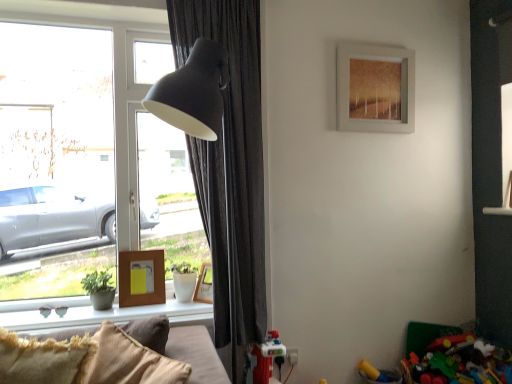
Question: Considering the relative sizes of woodenobject at lower left, which is the first picture frame from left to right, and matte brown picture frame at upper center, which is counted as the 1th picture frame, starting from the top, in the image provided, is woodenobject at lower left, which is the first picture frame from left to right, wider than matte brown picture frame at upper center, which is counted as the 1th picture frame, starting from the top,?

Choices:
 (A) no
 (B) yes

Answer: (B)

Question: From a real-world perspective, is woodenobject at lower left, which is the first picture frame from left to right, physically below matte brown picture frame at upper center, which is counted as the 1th picture frame, starting from the top?

Choices:
 (A) yes
 (B) no

Answer: (A)

Question: Is woodenobject at lower left, the 3th picture frame positioned from the right, taller than matte brown picture frame at upper center, marked as the 1th picture frame in a right-to-left arrangement?

Choices:
 (A) no
 (B) yes

Answer: (A)

Question: Can you confirm if woodenobject at lower left, which is the second picture frame in bottom-to-top order, is shorter than matte brown picture frame at upper center, the 3th picture frame ordered from the bottom?

Choices:
 (A) yes
 (B) no

Answer: (A)

Question: From the image's perspective, is woodenobject at lower left, arranged as the 2th picture frame when viewed from the top, over matte brown picture frame at upper center, marked as the 1th picture frame in a right-to-left arrangement?

Choices:
 (A) no
 (B) yes

Answer: (A)

Question: Is smooth concrete window sill at lower left situated inside matte brown picture frame at upper center, marked as the 1th picture frame in a right-to-left arrangement, or outside?

Choices:
 (A) inside
 (B) outside

Answer: (B)

Question: From a real-world perspective, is smooth concrete window sill at lower left positioned above or below matte brown picture frame at upper center, marked as the 1th picture frame in a right-to-left arrangement?

Choices:
 (A) above
 (B) below

Answer: (B)

Question: Is smooth concrete window sill at lower left taller or shorter than matte brown picture frame at upper center, arranged as the 3th picture frame when viewed from the left?

Choices:
 (A) short
 (B) tall

Answer: (A)

Question: Does point (31, 299) appear closer or farther from the camera than point (394, 110)?

Choices:
 (A) closer
 (B) farther

Answer: (A)

Question: From a real-world perspective, is dark grey fabric curtain at left physically located above or below transparent glass window at left?

Choices:
 (A) below
 (B) above

Answer: (A)

Question: From the image's perspective, is dark grey fabric curtain at left above or below transparent glass window at left?

Choices:
 (A) above
 (B) below

Answer: (B)

Question: Looking at the image, does dark grey fabric curtain at left seem bigger or smaller compared to transparent glass window at left?

Choices:
 (A) small
 (B) big

Answer: (A)

Question: Based on their positions, is dark grey fabric curtain at left located to the left or right of transparent glass window at left?

Choices:
 (A) left
 (B) right

Answer: (B)

Question: Is dark grey fabric curtain at left wider or thinner than smooth concrete window sill at lower left?

Choices:
 (A) thin
 (B) wide

Answer: (B)

Question: Looking at the image, does dark grey fabric curtain at left seem bigger or smaller compared to smooth concrete window sill at lower left?

Choices:
 (A) big
 (B) small

Answer: (A)